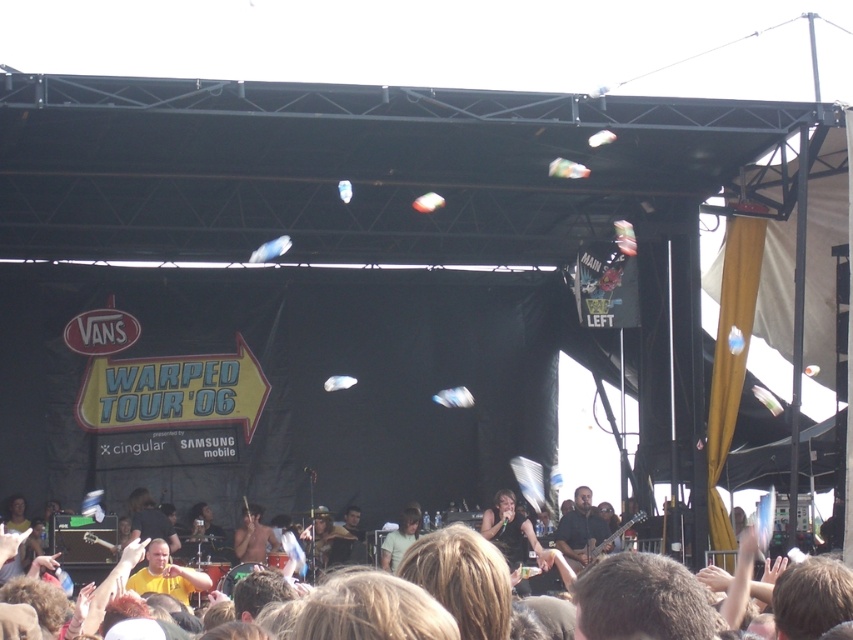
You are a photographer at the concert and want to capture a clear shot of both the dark brown leather guitar at center and the shiny metallic guitar at center. Which guitar will appear larger in your photo?

The dark brown leather guitar at center will appear larger in the photo because it is closer to the viewer than the shiny metallic guitar at center.

You are a photographer at the concert and want to capture both the dark brown leather guitar at center and the shiny metallic guitar at center in a single shot. Which guitar should you position closer to the left side of your camera frame to include both?

To capture both the dark brown leather guitar at center and the shiny metallic guitar at center in one shot, position the shiny metallic guitar at center closer to the left side of your frame since the dark brown leather guitar at center is to the right of it.